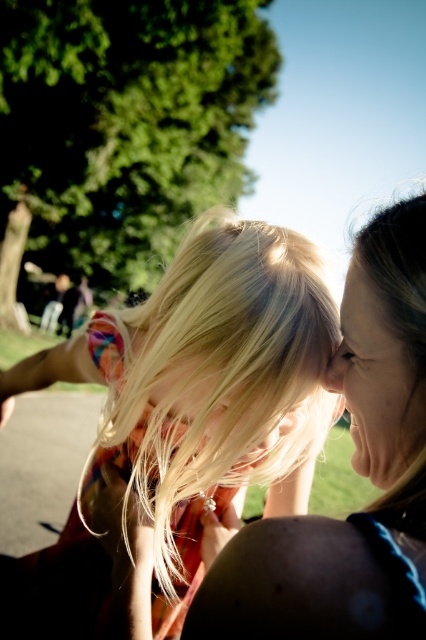
Question: Where is matte black hair at center located in relation to smooth skin nose at center in the image?

Choices:
 (A) left
 (B) right

Answer: (A)

Question: Observing the image, what is the correct spatial positioning of matte black hair at center in reference to smooth skin nose at center?

Choices:
 (A) right
 (B) left

Answer: (B)

Question: Estimate the real-world distances between objects in this image. Which object is farther from the blonde hair at center?

Choices:
 (A) smooth skin nose at center
 (B) matte black hair at center
 (C) smooth skin face at right

Answer: (A)

Question: Considering the real-world distances, which object is farthest from the blonde hair at center?

Choices:
 (A) smooth skin face at right
 (B) matte black hair at center
 (C) smooth skin nose at center

Answer: (C)

Question: Does blonde hair at center appear over smooth skin face at right?

Choices:
 (A) yes
 (B) no

Answer: (A)

Question: Which is farther from the matte black hair at center?

Choices:
 (A) smooth skin face at right
 (B) smooth skin nose at center

Answer: (B)